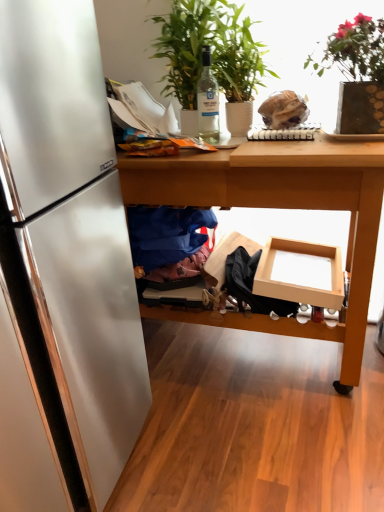
Question: Would you say wooden table at center contains blue fabric at lower center?

Choices:
 (A) yes
 (B) no

Answer: (A)

Question: Can you confirm if wooden table at center is positioned to the right of blue fabric at lower center?

Choices:
 (A) no
 (B) yes

Answer: (B)

Question: Is wooden table at center further to the viewer compared to blue fabric at lower center?

Choices:
 (A) no
 (B) yes

Answer: (A)

Question: From a real-world perspective, is wooden table at center positioned under blue fabric at lower center based on gravity?

Choices:
 (A) no
 (B) yes

Answer: (B)

Question: Is wooden table at center outside of blue fabric at lower center?

Choices:
 (A) no
 (B) yes

Answer: (B)

Question: Is blue fabric at lower center wider or thinner than clear glass bottle at center?

Choices:
 (A) thin
 (B) wide

Answer: (B)

Question: Is blue fabric at lower center in front of or behind clear glass bottle at center in the image?

Choices:
 (A) behind
 (B) front

Answer: (A)

Question: Based on their sizes in the image, would you say blue fabric at lower center is bigger or smaller than clear glass bottle at center?

Choices:
 (A) small
 (B) big

Answer: (B)

Question: From the image's perspective, is blue fabric at lower center positioned above or below clear glass bottle at center?

Choices:
 (A) above
 (B) below

Answer: (B)

Question: Based on their sizes in the image, would you say blue fabric at lower center is bigger or smaller than green leafy plant at upper center, the second houseplant positioned from the right?

Choices:
 (A) small
 (B) big

Answer: (A)

Question: Is blue fabric at lower center in front of or behind green leafy plant at upper center, placed as the first houseplant when sorted from left to right, in the image?

Choices:
 (A) behind
 (B) front

Answer: (A)

Question: Considering the positions of blue fabric at lower center and green leafy plant at upper center, the second houseplant positioned from the right, in the image, is blue fabric at lower center wider or thinner than green leafy plant at upper center, the second houseplant positioned from the right,?

Choices:
 (A) thin
 (B) wide

Answer: (A)

Question: Based on their positions, is blue fabric at lower center located to the left or right of green leafy plant at upper center, the second houseplant positioned from the right?

Choices:
 (A) right
 (B) left

Answer: (B)

Question: From the image's perspective, relative to wooden table at center, is green leafy plant at upper right, positioned as the second houseplant in left-to-right order, above or below?

Choices:
 (A) above
 (B) below

Answer: (A)

Question: Is point (359, 30) positioned closer to the camera than point (240, 167)?

Choices:
 (A) closer
 (B) farther

Answer: (A)